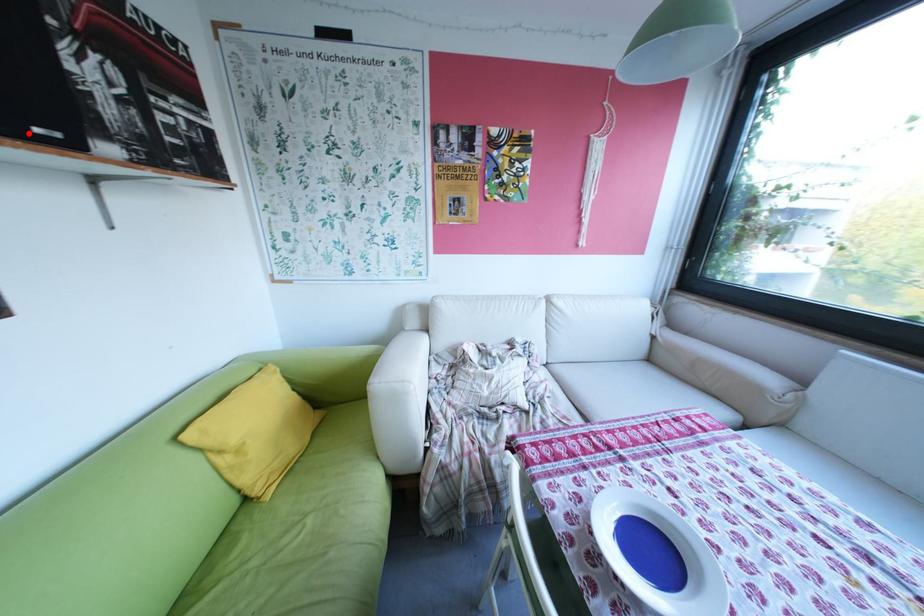
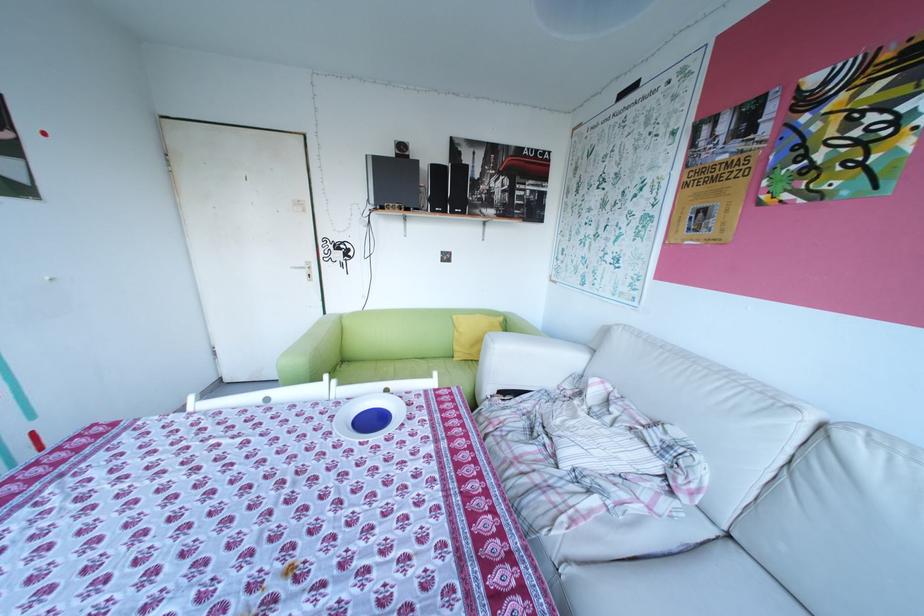
Find the pixel in the second image that matches the highlighted location in the first image.

(466, 212)